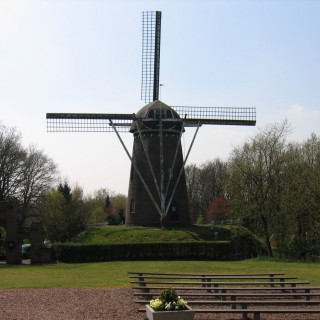
I want to click on risers, so click(x=222, y=286).